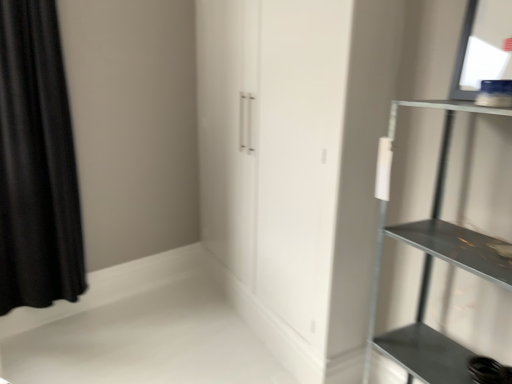
Where is `metallic gray shelf at right`? This screenshot has height=384, width=512. metallic gray shelf at right is located at coordinates (431, 245).

Based on the photo, measure the distance between metallic gray shelf at right and camera.

A distance of 1.03 meters exists between metallic gray shelf at right and camera.

What do you see at coordinates (431, 245) in the screenshot? This screenshot has width=512, height=384. I see `metallic gray shelf at right` at bounding box center [431, 245].

Locate an element on the screen. Image resolution: width=512 pixels, height=384 pixels. black velvet curtain at left is located at coordinates (36, 163).

The height and width of the screenshot is (384, 512). What do you see at coordinates (36, 163) in the screenshot? I see `black velvet curtain at left` at bounding box center [36, 163].

Locate an element on the screen. metallic gray shelf at right is located at coordinates (431, 245).

Can you confirm if metallic gray shelf at right is positioned to the right of black velvet curtain at left?

Yes.

Which is in front, metallic gray shelf at right or black velvet curtain at left?

Positioned in front is metallic gray shelf at right.

Considering the points (377, 233) and (16, 293), which point is in front, point (377, 233) or point (16, 293)?

The point (377, 233) is closer to the camera.

From the image's perspective, is metallic gray shelf at right over black velvet curtain at left?

No, from the image's perspective, metallic gray shelf at right is not above black velvet curtain at left.

From a real-world perspective, is metallic gray shelf at right over black velvet curtain at left?

Incorrect, from a real-world perspective, metallic gray shelf at right is lower than black velvet curtain at left.

Considering the relative sizes of metallic gray shelf at right and black velvet curtain at left in the image provided, is metallic gray shelf at right thinner than black velvet curtain at left?

No.

Between metallic gray shelf at right and black velvet curtain at left, which one has less height?

With less height is metallic gray shelf at right.

In terms of size, does metallic gray shelf at right appear bigger or smaller than black velvet curtain at left?

In the image, metallic gray shelf at right appears to be larger than black velvet curtain at left.

Would you say metallic gray shelf at right is inside or outside black velvet curtain at left?

metallic gray shelf at right lies outside black velvet curtain at left.

Is metallic gray shelf at right positioned far away from black velvet curtain at left?

Yes.

Is metallic gray shelf at right facing away from black velvet curtain at left?

That's not correct — metallic gray shelf at right is not looking away from black velvet curtain at left.

How different are the orientations of metallic gray shelf at right and black velvet curtain at left in degrees?

There is a 102-degree angle between the facing directions of metallic gray shelf at right and black velvet curtain at left.

You are a GUI agent. You are given a task and a screenshot of the screen. Output one action in this format:
    pyautogui.click(x=<x>, y=<y>)
    Task: Click on the curtain above the metallic gray shelf at right (from the image's perspective)
    
    Given the screenshot: What is the action you would take?
    pyautogui.click(x=36, y=163)

From the picture: Is black velvet curtain at left to the right of metallic gray shelf at right from the viewer's perspective?

Incorrect, black velvet curtain at left is not on the right side of metallic gray shelf at right.

Between black velvet curtain at left and metallic gray shelf at right, which one is positioned in front?

Positioned in front is metallic gray shelf at right.

Does point (35, 269) lie behind point (450, 104)?

Yes, point (35, 269) is behind point (450, 104).

From the image's perspective, is black velvet curtain at left beneath metallic gray shelf at right?

Actually, black velvet curtain at left appears above metallic gray shelf at right in the image.

From a real-world perspective, is black velvet curtain at left positioned above or below metallic gray shelf at right?

Clearly, from a real-world perspective, black velvet curtain at left is above metallic gray shelf at right.

Can you confirm if black velvet curtain at left is thinner than metallic gray shelf at right?

Correct, the width of black velvet curtain at left is less than that of metallic gray shelf at right.

Considering the relative sizes of black velvet curtain at left and metallic gray shelf at right in the image provided, is black velvet curtain at left taller than metallic gray shelf at right?

Yes, black velvet curtain at left is taller than metallic gray shelf at right.

Is black velvet curtain at left bigger or smaller than metallic gray shelf at right?

Considering their sizes, black velvet curtain at left takes up less space than metallic gray shelf at right.

Can we say black velvet curtain at left lies outside metallic gray shelf at right?

Absolutely, black velvet curtain at left is external to metallic gray shelf at right.

Is black velvet curtain at left not near metallic gray shelf at right?

Yes, black velvet curtain at left and metallic gray shelf at right are quite far apart.

Could you tell me if black velvet curtain at left is facing metallic gray shelf at right?

No, black velvet curtain at left is not turned towards metallic gray shelf at right.

How many degrees apart are the facing directions of black velvet curtain at left and metallic gray shelf at right?

The facing directions of black velvet curtain at left and metallic gray shelf at right are 102 degrees apart.

Locate an element on the screen. The height and width of the screenshot is (384, 512). curtain on the left of the metallic gray shelf at right is located at coordinates (36, 163).

Locate an element on the screen. curtain that appears above the metallic gray shelf at right (from the image's perspective) is located at coordinates (36, 163).

The image size is (512, 384). Find the location of `shelf lying in front of the black velvet curtain at left`. shelf lying in front of the black velvet curtain at left is located at coordinates (431, 245).